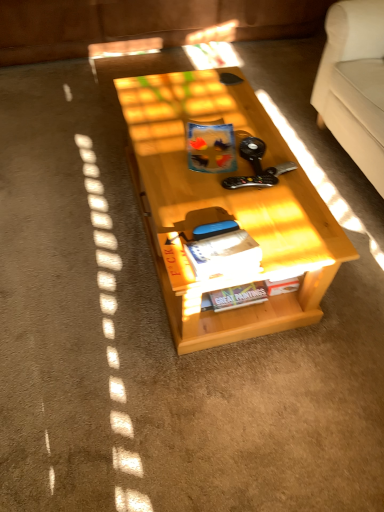
Question: From a real-world perspective, is matte paper magazine at center positioned over matte plastic book at center, which ranks as the 1th book in top-to-bottom order, based on gravity?

Choices:
 (A) no
 (B) yes

Answer: (B)

Question: Does matte paper magazine at center appear on the left side of matte plastic book at center, placed as the 3th book when sorted from bottom to top?

Choices:
 (A) yes
 (B) no

Answer: (B)

Question: Is matte paper magazine at center further to the viewer compared to matte plastic book at center, placed as the 3th book when sorted from bottom to top?

Choices:
 (A) no
 (B) yes

Answer: (A)

Question: Considering the relative positions of matte paper magazine at center and matte plastic book at center, placed as the 3th book when sorted from bottom to top, in the image provided, is matte paper magazine at center to the right of matte plastic book at center, placed as the 3th book when sorted from bottom to top, from the viewer's perspective?

Choices:
 (A) yes
 (B) no

Answer: (A)

Question: Is matte paper magazine at center bigger than matte plastic book at center, which ranks as the 1th book in top-to-bottom order?

Choices:
 (A) no
 (B) yes

Answer: (A)

Question: Is point (248, 304) closer or farther from the camera than point (244, 260)?

Choices:
 (A) closer
 (B) farther

Answer: (B)

Question: Considering the positions of hardcover book at center, which is the 3th book in top-to-bottom order, and matte paper magazine at center in the image, is hardcover book at center, which is the 3th book in top-to-bottom order, wider or thinner than matte paper magazine at center?

Choices:
 (A) thin
 (B) wide

Answer: (A)

Question: Is hardcover book at center, which is the first book in bottom-to-top order, taller or shorter than matte paper magazine at center?

Choices:
 (A) tall
 (B) short

Answer: (B)

Question: Visually, is hardcover book at center, which is the 3th book in top-to-bottom order, positioned to the left or to the right of matte paper magazine at center?

Choices:
 (A) left
 (B) right

Answer: (B)

Question: In the image, is light wood table at center positioned in front of or behind matte paper magazine at center?

Choices:
 (A) behind
 (B) front

Answer: (A)

Question: In terms of width, does light wood table at center look wider or thinner when compared to matte paper magazine at center?

Choices:
 (A) wide
 (B) thin

Answer: (A)

Question: In terms of height, does light wood table at center look taller or shorter compared to matte paper magazine at center?

Choices:
 (A) tall
 (B) short

Answer: (A)

Question: In the image, is light wood table at center on the left side or the right side of matte paper magazine at center?

Choices:
 (A) left
 (B) right

Answer: (A)

Question: From the image's perspective, is matte plastic book at center, which ranks as the second book in front-to-back order, above or below hardcover book at center, which is the second book from bottom to top?

Choices:
 (A) above
 (B) below

Answer: (A)

Question: From a real-world perspective, relative to hardcover book at center, which is the second book from bottom to top, is matte plastic book at center, which is the second book in back-to-front order, vertically above or below?

Choices:
 (A) below
 (B) above

Answer: (A)